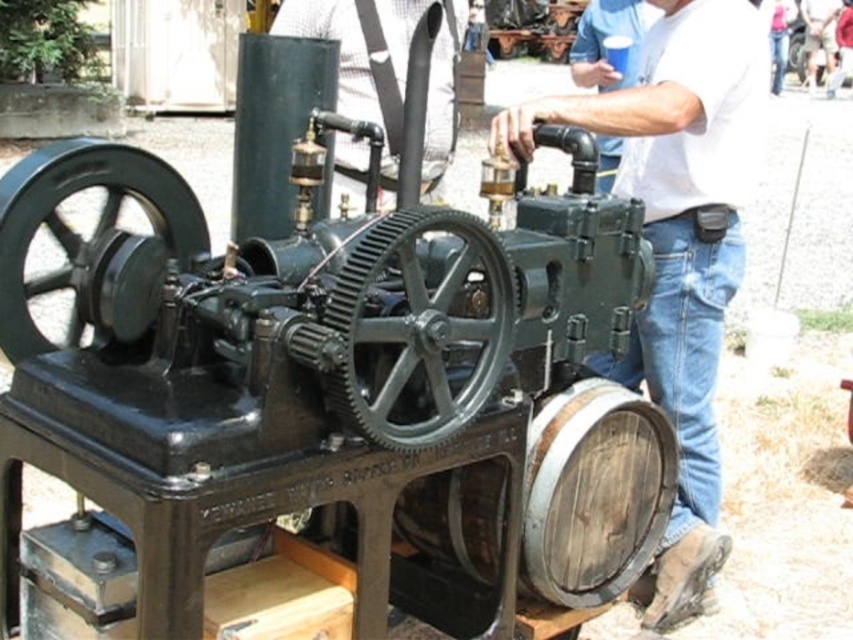
You are standing in front of the vintage steam engine at the exhibition. There are two points marked on the engine, one at coordinate point (199,554) and another at point (360,150). If you want to touch the point that is nearer to you without moving your position, which coordinate should you aim for?

You should aim for point (199,554) because it is closer to the camera than point (360,150).

You are standing in front of the vintage steam engine at the exhibition. There are two points marked on the engine. The first point is located at coordinates point (708,268), and the second point is at point (352,100). Which of these two points is nearer to you?

Point (708,268) is closer to the viewer than point (352,100).

You are a maintenance worker inspecting the black cast iron steam engine at center and the matte black tank at center. Which object is positioned higher in the image?

The matte black tank at center is positioned higher than the black cast iron steam engine at center.